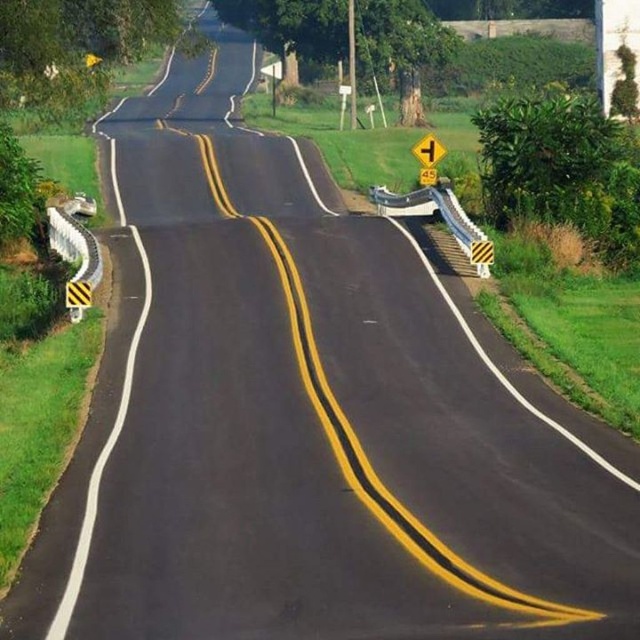
Question: Can you confirm if yellow plastic sign at upper center is positioned above yellow striped traffic sign at center?

Choices:
 (A) no
 (B) yes

Answer: (B)

Question: Which point is closer to the camera?

Choices:
 (A) (444, 148)
 (B) (474, 253)

Answer: (B)

Question: Which object is farther from the camera taking this photo?

Choices:
 (A) yellow striped traffic sign at center
 (B) yellow plastic sign at upper center

Answer: (B)

Question: Is yellow plastic sign at upper center positioned behind yellow striped traffic sign at center?

Choices:
 (A) yes
 (B) no

Answer: (A)

Question: Which point is closer to the camera?

Choices:
 (A) yellow plastic sign at upper center
 (B) yellow striped traffic sign at center

Answer: (B)

Question: Is yellow plastic sign at upper center positioned at the back of yellow striped traffic sign at center?

Choices:
 (A) no
 (B) yes

Answer: (B)